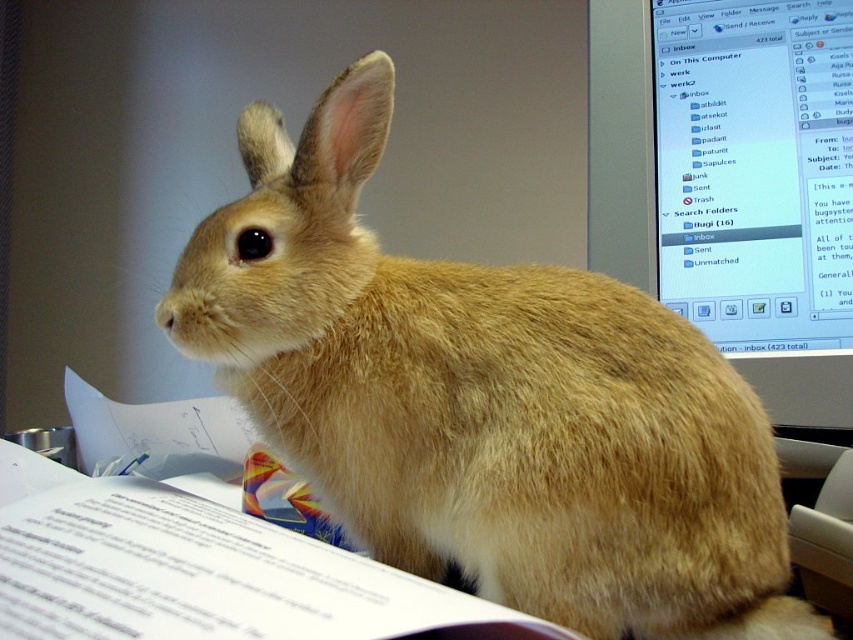
In the scene shown: Can you confirm if furry beige rabbit at center is shorter than matte plastic monitor at upper right?

In fact, furry beige rabbit at center may be taller than matte plastic monitor at upper right.

Can you confirm if furry beige rabbit at center is positioned to the right of matte plastic monitor at upper right?

Incorrect, furry beige rabbit at center is not on the right side of matte plastic monitor at upper right.

This screenshot has width=853, height=640. Describe the element at coordinates (485, 401) in the screenshot. I see `furry beige rabbit at center` at that location.

Locate an element on the screen. furry beige rabbit at center is located at coordinates (485, 401).